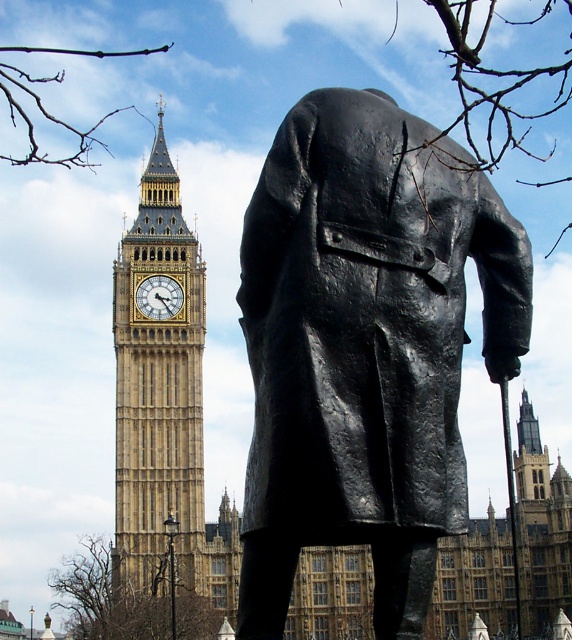
Based on the provided image, where is the golden stone clock tower at left located in terms of coordinates?

The golden stone clock tower at left is located at coordinates point (158, 394).